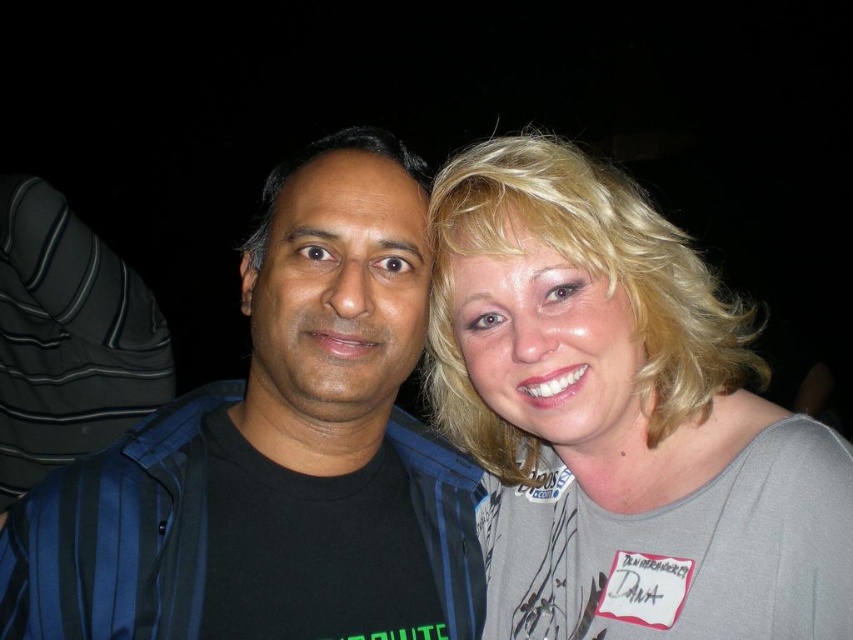
Question: Which of the following is the farthest from the observer?

Choices:
 (A) black matte jacket at left
 (B) gray fabric shirt at upper right

Answer: (A)

Question: Is gray fabric shirt at upper right positioned at the back of black matte jacket at left?

Choices:
 (A) yes
 (B) no

Answer: (B)

Question: Which point is farther from the camera taking this photo?

Choices:
 (A) (822, 568)
 (B) (84, 480)

Answer: (B)

Question: Does gray fabric shirt at upper right appear over black matte jacket at left?

Choices:
 (A) yes
 (B) no

Answer: (B)

Question: Can you confirm if gray fabric shirt at upper right is wider than black matte jacket at left?

Choices:
 (A) yes
 (B) no

Answer: (B)